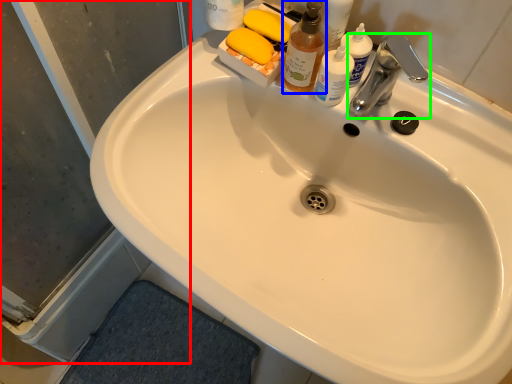
Question: Estimate the real-world distances between objects in this image. Which object is closer to screen door (highlighted by a red box), cleaning product (highlighted by a blue box) or tap (highlighted by a green box)?

Choices:
 (A) cleaning product
 (B) tap

Answer: (A)